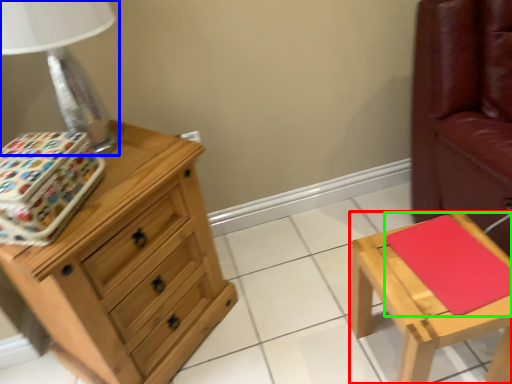
Question: Which object is positioned farthest from stool (highlighted by a red box)? Select from table lamp (highlighted by a blue box) and pad (highlighted by a green box).

Choices:
 (A) table lamp
 (B) pad

Answer: (A)